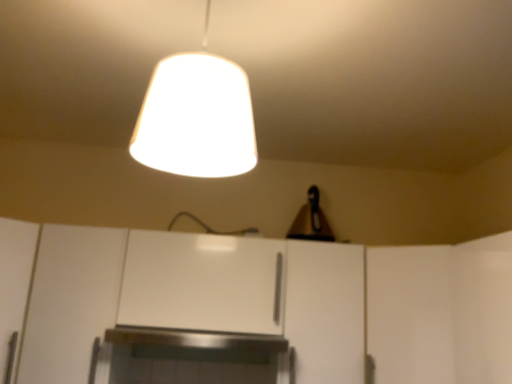
Identify the location of white matte lampshade at upper center. (196, 117).

Image resolution: width=512 pixels, height=384 pixels. What are the coordinates of `white matte cabinet at center, placed as the 2th cabinetry when sorted from left to right` in the screenshot? It's located at (202, 283).

How much space does white matte cabinet at center, which is counted as the first cabinetry, starting from the right, occupy horizontally?

It is 18.28 inches.

Locate an element on the screen. The height and width of the screenshot is (384, 512). white matte lampshade at upper center is located at coordinates (196, 117).

Relative to white matte cabinet at center, which is counted as the first cabinetry, starting from the right, is white matte cabinet at lower left, placed as the 1th cabinetry when sorted from left to right, in front or behind?

In the image, white matte cabinet at lower left, placed as the 1th cabinetry when sorted from left to right, appears in front of white matte cabinet at center, which is counted as the first cabinetry, starting from the right.

From the image's perspective, is white matte cabinet at lower left, placed as the 1th cabinetry when sorted from left to right, above white matte cabinet at center, which is counted as the first cabinetry, starting from the right?

Indeed, from the image's perspective, white matte cabinet at lower left, placed as the 1th cabinetry when sorted from left to right, is shown above white matte cabinet at center, which is counted as the first cabinetry, starting from the right.

Does white matte cabinet at lower left, placed as the 1th cabinetry when sorted from left to right, have a greater width compared to white matte cabinet at center, which is counted as the first cabinetry, starting from the right?

Incorrect, the width of white matte cabinet at lower left, placed as the 1th cabinetry when sorted from left to right, does not surpass that of white matte cabinet at center, which is counted as the first cabinetry, starting from the right.

Which is behind, point (100, 232) or point (337, 267)?

Point (337, 267)

How different are the orientations of white matte cabinet at center, which ranks as the third cabinetry in left-to-right order, and white matte cabinet at center, which ranks as the 2th cabinetry in right-to-left order, in degrees?

The facing directions of white matte cabinet at center, which ranks as the third cabinetry in left-to-right order, and white matte cabinet at center, which ranks as the 2th cabinetry in right-to-left order, are 0.133 degrees apart.

From the image's perspective, between white matte cabinet at center, which ranks as the third cabinetry in left-to-right order, and white matte cabinet at center, which ranks as the 2th cabinetry in right-to-left order, which one is located above?

white matte cabinet at center, which ranks as the 2th cabinetry in right-to-left order, appears higher in the image.

Is white matte cabinet at center, which is counted as the first cabinetry, starting from the right, turned away from white matte cabinet at center, placed as the 2th cabinetry when sorted from left to right?

No, white matte cabinet at center, placed as the 2th cabinetry when sorted from left to right, is not at the back of white matte cabinet at center, which is counted as the first cabinetry, starting from the right.

Who is shorter, white matte cabinet at center, which is counted as the first cabinetry, starting from the right, or white matte cabinet at center, placed as the 2th cabinetry when sorted from left to right?

white matte cabinet at center, placed as the 2th cabinetry when sorted from left to right, is shorter.

Between white matte cabinet at lower left, placed as the 1th cabinetry when sorted from left to right, and white matte cabinet at center, placed as the 2th cabinetry when sorted from left to right, which one appears on the right side from the viewer's perspective?

Positioned to the right is white matte cabinet at center, placed as the 2th cabinetry when sorted from left to right.

Are white matte cabinet at lower left, placed as the 1th cabinetry when sorted from left to right, and white matte cabinet at center, placed as the 2th cabinetry when sorted from left to right, located far from each other?

No, white matte cabinet at lower left, placed as the 1th cabinetry when sorted from left to right, is not far from white matte cabinet at center, placed as the 2th cabinetry when sorted from left to right.

Which of these two, white matte cabinet at lower left, which is counted as the 3th cabinetry, starting from the right, or white matte cabinet at center, which ranks as the 2th cabinetry in right-to-left order, stands shorter?

white matte cabinet at center, which ranks as the 2th cabinetry in right-to-left order, is shorter.

Is white matte cabinet at lower left, which is counted as the 3th cabinetry, starting from the right, completely or partially outside of white matte cabinet at center, which ranks as the 2th cabinetry in right-to-left order?

Yes, white matte cabinet at lower left, which is counted as the 3th cabinetry, starting from the right, is outside of white matte cabinet at center, which ranks as the 2th cabinetry in right-to-left order.

Image resolution: width=512 pixels, height=384 pixels. I want to click on cabinetry that is the 1st object directly below the white matte cabinet at center, which ranks as the 2th cabinetry in right-to-left order (from a real-world perspective), so click(325, 311).

Which object is wider, white matte cabinet at center, which ranks as the 2th cabinetry in right-to-left order, or white matte cabinet at center, which ranks as the third cabinetry in left-to-right order?

With larger width is white matte cabinet at center, which ranks as the third cabinetry in left-to-right order.

Considering the sizes of white matte cabinet at center, which ranks as the 2th cabinetry in right-to-left order, and white matte cabinet at center, which is counted as the first cabinetry, starting from the right, in the image, is white matte cabinet at center, which ranks as the 2th cabinetry in right-to-left order, taller or shorter than white matte cabinet at center, which is counted as the first cabinetry, starting from the right,?

Clearly, white matte cabinet at center, which ranks as the 2th cabinetry in right-to-left order, is shorter compared to white matte cabinet at center, which is counted as the first cabinetry, starting from the right.

Looking at this image, is white matte cabinet at center, placed as the 2th cabinetry when sorted from left to right, positioned beyond the bounds of white matte cabinet at center, which ranks as the third cabinetry in left-to-right order?

Indeed, white matte cabinet at center, placed as the 2th cabinetry when sorted from left to right, is completely outside white matte cabinet at center, which ranks as the third cabinetry in left-to-right order.

From a real-world perspective, is white matte cabinet at center, which ranks as the 2th cabinetry in right-to-left order, located higher than white matte lampshade at upper center?

Incorrect, from a real-world perspective, white matte cabinet at center, which ranks as the 2th cabinetry in right-to-left order, is lower than white matte lampshade at upper center.

Can you see white matte cabinet at center, which ranks as the 2th cabinetry in right-to-left order, touching white matte lampshade at upper center?

No.

Considering the positions of objects white matte cabinet at center, placed as the 2th cabinetry when sorted from left to right, and white matte lampshade at upper center in the image provided, who is behind, white matte cabinet at center, placed as the 2th cabinetry when sorted from left to right, or white matte lampshade at upper center?

Positioned behind is white matte cabinet at center, placed as the 2th cabinetry when sorted from left to right.

Is white matte cabinet at center, placed as the 2th cabinetry when sorted from left to right, positioned with its back to white matte lampshade at upper center?

No, white matte cabinet at center, placed as the 2th cabinetry when sorted from left to right,'s orientation is not away from white matte lampshade at upper center.

From a real-world perspective, is white matte lampshade at upper center below white matte cabinet at lower left, which is counted as the 3th cabinetry, starting from the right?

No, from a real-world perspective, white matte lampshade at upper center is not below white matte cabinet at lower left, which is counted as the 3th cabinetry, starting from the right.

From the image's perspective, which is above, white matte lampshade at upper center or white matte cabinet at lower left, placed as the 1th cabinetry when sorted from left to right?

white matte lampshade at upper center.

At what (x,y) coordinates should I click in order to perform the action: click on lamp above the white matte cabinet at lower left, which is counted as the 3th cabinetry, starting from the right (from the image's perspective). Please return your answer as a coordinate pair (x, y). The height and width of the screenshot is (384, 512). Looking at the image, I should click on (196, 117).

Is white matte lampshade at upper center next to white matte cabinet at lower left, which is counted as the 3th cabinetry, starting from the right, and touching it?

white matte lampshade at upper center and white matte cabinet at lower left, which is counted as the 3th cabinetry, starting from the right, are clearly separated.

Who is smaller, white matte cabinet at center, which is counted as the first cabinetry, starting from the right, or white matte cabinet at lower left, which is counted as the 3th cabinetry, starting from the right?

With smaller size is white matte cabinet at lower left, which is counted as the 3th cabinetry, starting from the right.

You are a GUI agent. You are given a task and a screenshot of the screen. Output one action in this format:
    pyautogui.click(x=<x>, y=<y>)
    Task: Click on the 1st cabinetry above the white matte cabinet at lower left, placed as the 1th cabinetry when sorted from left to right (from a real-world perspective)
    This screenshot has width=512, height=384.
    Given the screenshot: What is the action you would take?
    pyautogui.click(x=325, y=311)

In the image, is white matte cabinet at center, which ranks as the third cabinetry in left-to-right order, positioned in front of or behind white matte cabinet at lower left, which is counted as the 3th cabinetry, starting from the right?

white matte cabinet at center, which ranks as the third cabinetry in left-to-right order, is behind white matte cabinet at lower left, which is counted as the 3th cabinetry, starting from the right.

You are a GUI agent. You are given a task and a screenshot of the screen. Output one action in this format:
    pyautogui.click(x=<x>, y=<y>)
    Task: Click on the cabinetry in front of the white matte cabinet at center, which ranks as the third cabinetry in left-to-right order
    
    Given the screenshot: What is the action you would take?
    pyautogui.click(x=70, y=301)

Identify the location of cabinetry that is the 1st one when counting leftward from the white matte cabinet at center, which is counted as the first cabinetry, starting from the right. This screenshot has width=512, height=384. (202, 283).

Looking at the image, which one is located closer to white matte door at right, white matte cabinet at center, which is counted as the first cabinetry, starting from the right, or white matte lampshade at upper center?

Among the two, white matte cabinet at center, which is counted as the first cabinetry, starting from the right, is located nearer to white matte door at right.

Looking at the image, which one is located further to white matte lampshade at upper center, white matte cabinet at lower left, placed as the 1th cabinetry when sorted from left to right, or white matte cabinet at center, which ranks as the 2th cabinetry in right-to-left order?

white matte cabinet at lower left, placed as the 1th cabinetry when sorted from left to right, is positioned further to the anchor white matte lampshade at upper center.

Looking at the image, which one is located further to white matte lampshade at upper center, white matte cabinet at center, which ranks as the third cabinetry in left-to-right order, or white matte door at right?

white matte door at right lies further to white matte lampshade at upper center than the other object.

Based on their spatial positions, is white matte door at right or white matte cabinet at center, which ranks as the 2th cabinetry in right-to-left order, further from white matte lampshade at upper center?

white matte door at right is further to white matte lampshade at upper center.

From the image, which object appears to be nearer to white matte cabinet at center, placed as the 2th cabinetry when sorted from left to right, white matte cabinet at center, which is counted as the first cabinetry, starting from the right, or white matte door at right?

Among the two, white matte cabinet at center, which is counted as the first cabinetry, starting from the right, is located nearer to white matte cabinet at center, placed as the 2th cabinetry when sorted from left to right.

Estimate the real-world distances between objects in this image. Which object is further from white matte door at right, white matte cabinet at center, placed as the 2th cabinetry when sorted from left to right, or white matte cabinet at center, which ranks as the third cabinetry in left-to-right order?

Among the two, white matte cabinet at center, placed as the 2th cabinetry when sorted from left to right, is located further to white matte door at right.

Which object lies further to the anchor point white matte cabinet at center, placed as the 2th cabinetry when sorted from left to right, white matte door at right or white matte cabinet at lower left, placed as the 1th cabinetry when sorted from left to right?

Among the two, white matte door at right is located further to white matte cabinet at center, placed as the 2th cabinetry when sorted from left to right.

From the image, which object appears to be nearer to white matte door at right, white matte cabinet at center, which ranks as the 2th cabinetry in right-to-left order, or white matte lampshade at upper center?

Based on the image, white matte cabinet at center, which ranks as the 2th cabinetry in right-to-left order, appears to be nearer to white matte door at right.

You are a GUI agent. You are given a task and a screenshot of the screen. Output one action in this format:
    pyautogui.click(x=<x>, y=<y>)
    Task: Click on the lamp situated between white matte cabinet at lower left, which is counted as the 3th cabinetry, starting from the right, and white matte cabinet at center, which is counted as the first cabinetry, starting from the right, from left to right
    Image resolution: width=512 pixels, height=384 pixels.
    Given the screenshot: What is the action you would take?
    pyautogui.click(x=196, y=117)

The image size is (512, 384). I want to click on door between white matte lampshade at upper center and white matte cabinet at center, which is counted as the first cabinetry, starting from the right, in the up-down direction, so click(x=409, y=314).

Locate an element on the screen. Image resolution: width=512 pixels, height=384 pixels. lamp located between white matte cabinet at lower left, which is counted as the 3th cabinetry, starting from the right, and white matte door at right in the left-right direction is located at coordinates click(x=196, y=117).

Identify the location of cabinetry situated between white matte cabinet at lower left, placed as the 1th cabinetry when sorted from left to right, and white matte cabinet at center, which is counted as the first cabinetry, starting from the right, from left to right. (202, 283).